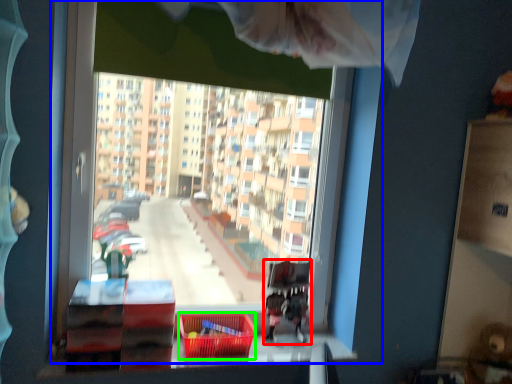
Question: Based on their relative distances, which object is farther from bunk bed (highlighted by a red box)? Choose from window (highlighted by a blue box) and basket (highlighted by a green box).

Choices:
 (A) window
 (B) basket

Answer: (A)